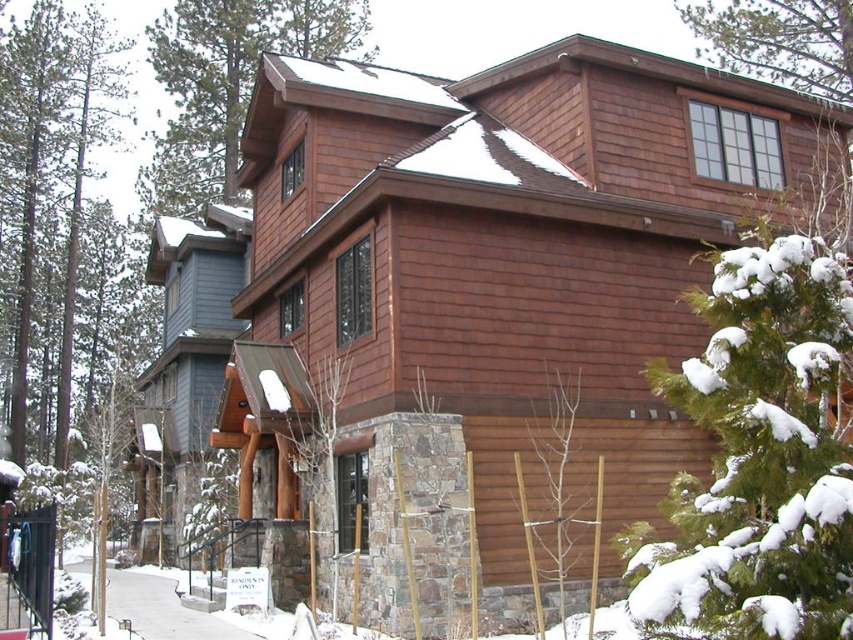
Measure the distance from green coniferous tree at left to green textured pine tree at upper right.

A distance of 32.70 meters exists between green coniferous tree at left and green textured pine tree at upper right.

Does point (36, 356) lie in front of point (834, 97)?

No, it is not.

The height and width of the screenshot is (640, 853). I want to click on green coniferous tree at left, so 48,193.

Does point (177, 216) come farther from viewer compared to point (555, 432)?

Yes, point (177, 216) is farther from viewer.

What are the coordinates of `green textured pine tree at upper center` in the screenshot? It's located at (227, 84).

Find the location of `green textured pine tree at upper center`. green textured pine tree at upper center is located at coordinates (227, 84).

Is point (119, 84) less distant than point (523, 497)?

No, (119, 84) is behind (523, 497).

Does green coniferous tree at left have a larger size compared to bare wood tree at center?

Indeed, green coniferous tree at left has a larger size compared to bare wood tree at center.

Who is more forward, (49, 29) or (596, 579)?

Positioned in front is point (596, 579).

Where is `green coniferous tree at left`? green coniferous tree at left is located at coordinates (48, 193).